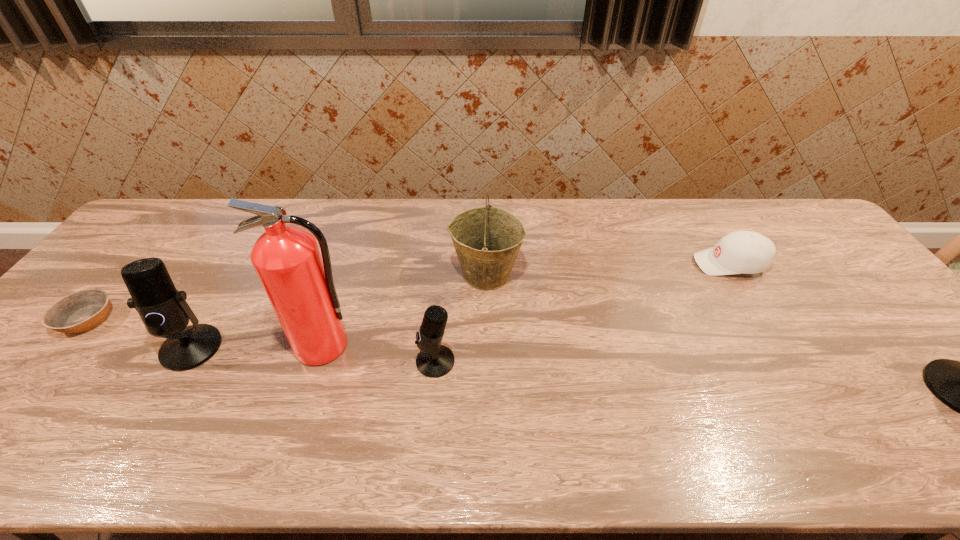
Where is `the second shortest microphone`? This screenshot has width=960, height=540. the second shortest microphone is located at coordinates (163, 309).

You are a GUI agent. You are given a task and a screenshot of the screen. Output one action in this format:
    pyautogui.click(x=<x>, y=<y>)
    Task: Click on the leftmost microphone
    Image resolution: width=960 pixels, height=540 pixels.
    Given the screenshot: What is the action you would take?
    pyautogui.click(x=163, y=309)

I want to click on the third shortest object, so click(434, 360).

Identify the location of the shortest microphone. The width and height of the screenshot is (960, 540). click(x=434, y=360).

Find the location of a particular element. The width and height of the screenshot is (960, 540). the sixth tallest object is located at coordinates pyautogui.click(x=740, y=252).

I want to click on baseball cap, so click(x=740, y=252).

The image size is (960, 540). Find the location of `bowl`. bowl is located at coordinates (80, 311).

The height and width of the screenshot is (540, 960). I want to click on the shortest object, so click(x=80, y=311).

The height and width of the screenshot is (540, 960). I want to click on wine bucket, so click(x=487, y=240).

Locate an element on the screen. The height and width of the screenshot is (540, 960). the fifth object from right to left is located at coordinates (299, 284).